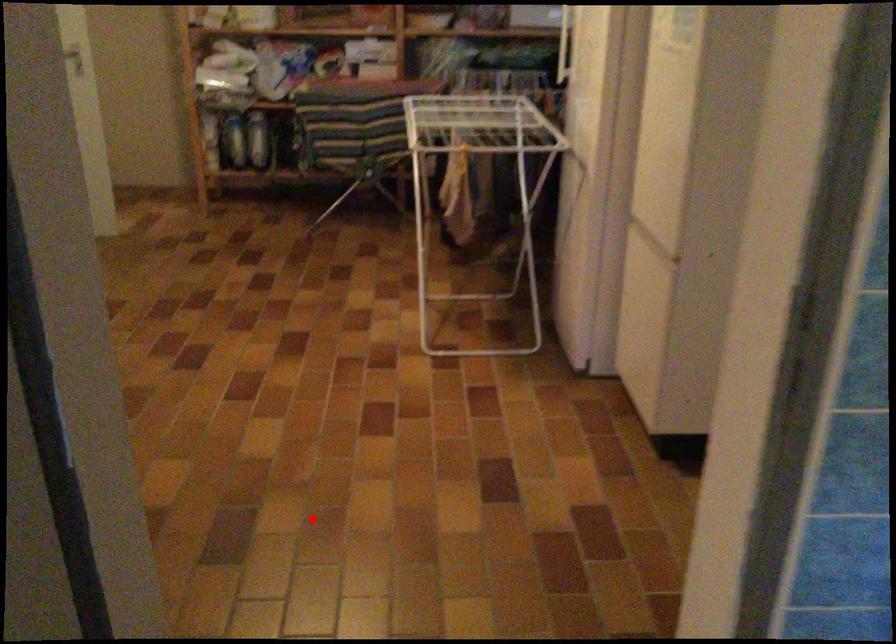
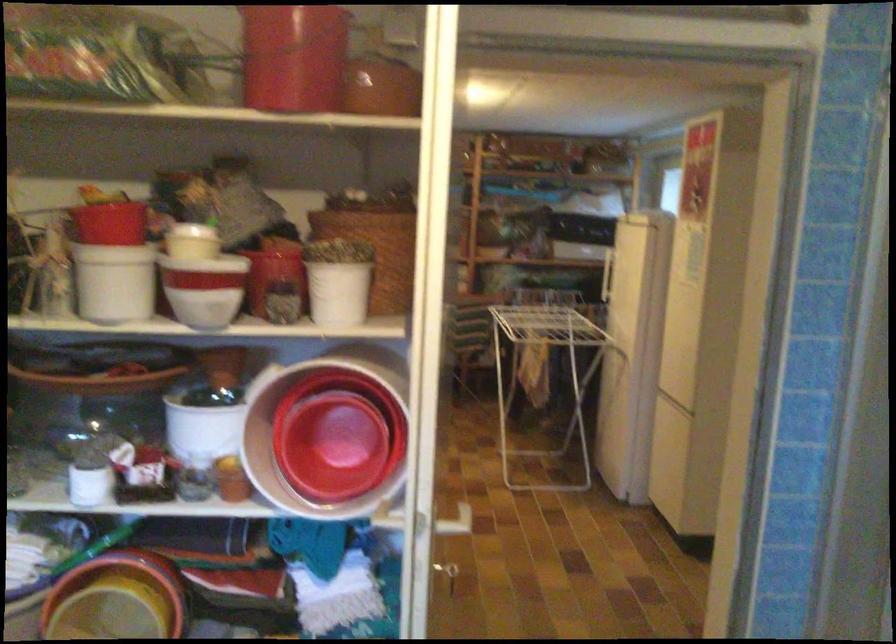
Question: I am providing you with two images of the same scene from different viewpoints. Given a red point in image1, look at the same physical point in image2. Is it:

Choices:
 (A) Closer to the viewpoint
 (B) Farther from the viewpoint

Answer: (B)